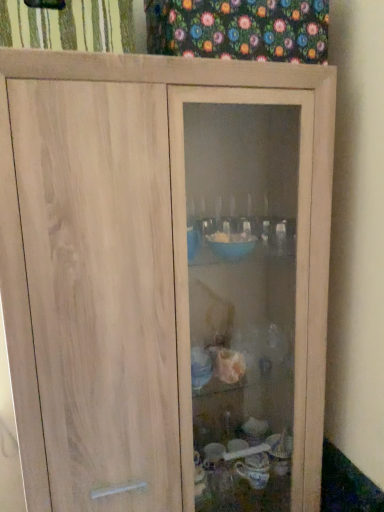
Question: Can you confirm if floral fabric at upper center, which is counted as the 1th curtain, starting from the right, is positioned to the left of green striped fabric at upper left, arranged as the 1th curtain when viewed from the left?

Choices:
 (A) yes
 (B) no

Answer: (B)

Question: Is floral fabric at upper center, which is counted as the 1th curtain, starting from the right, closer to the viewer compared to green striped fabric at upper left, the 2th curtain in the right-to-left sequence?

Choices:
 (A) yes
 (B) no

Answer: (B)

Question: Does floral fabric at upper center, which is counted as the 1th curtain, starting from the right, have a greater height compared to green striped fabric at upper left, arranged as the 1th curtain when viewed from the left?

Choices:
 (A) yes
 (B) no

Answer: (A)

Question: Does floral fabric at upper center, which is counted as the second curtain, starting from the left, have a lesser width compared to green striped fabric at upper left, arranged as the 1th curtain when viewed from the left?

Choices:
 (A) yes
 (B) no

Answer: (A)

Question: Is floral fabric at upper center, which is counted as the 1th curtain, starting from the right, to the right of green striped fabric at upper left, arranged as the 1th curtain when viewed from the left, from the viewer's perspective?

Choices:
 (A) yes
 (B) no

Answer: (A)

Question: From a real-world perspective, is floral fabric at upper center, which is counted as the 1th curtain, starting from the right, on green striped fabric at upper left, arranged as the 1th curtain when viewed from the left?

Choices:
 (A) no
 (B) yes

Answer: (B)

Question: Is green striped fabric at upper left, arranged as the 1th curtain when viewed from the left, outside of floral fabric at upper center, which is counted as the 1th curtain, starting from the right?

Choices:
 (A) no
 (B) yes

Answer: (B)

Question: Is green striped fabric at upper left, the 2th curtain in the right-to-left sequence, facing away from floral fabric at upper center, which is counted as the second curtain, starting from the left?

Choices:
 (A) yes
 (B) no

Answer: (B)

Question: Is green striped fabric at upper left, the 2th curtain in the right-to-left sequence, at the left side of floral fabric at upper center, which is counted as the second curtain, starting from the left?

Choices:
 (A) no
 (B) yes

Answer: (B)

Question: Is the position of green striped fabric at upper left, arranged as the 1th curtain when viewed from the left, more distant than that of floral fabric at upper center, which is counted as the 1th curtain, starting from the right?

Choices:
 (A) yes
 (B) no

Answer: (B)

Question: Can you confirm if green striped fabric at upper left, arranged as the 1th curtain when viewed from the left, is thinner than floral fabric at upper center, which is counted as the 1th curtain, starting from the right?

Choices:
 (A) yes
 (B) no

Answer: (B)

Question: Is green striped fabric at upper left, the 2th curtain in the right-to-left sequence, closer to camera compared to floral fabric at upper center, which is counted as the second curtain, starting from the left?

Choices:
 (A) yes
 (B) no

Answer: (A)

Question: Would you say green striped fabric at upper left, the 2th curtain in the right-to-left sequence, is to the left or to the right of floral fabric at upper center, which is counted as the 1th curtain, starting from the right, in the picture?

Choices:
 (A) left
 (B) right

Answer: (A)